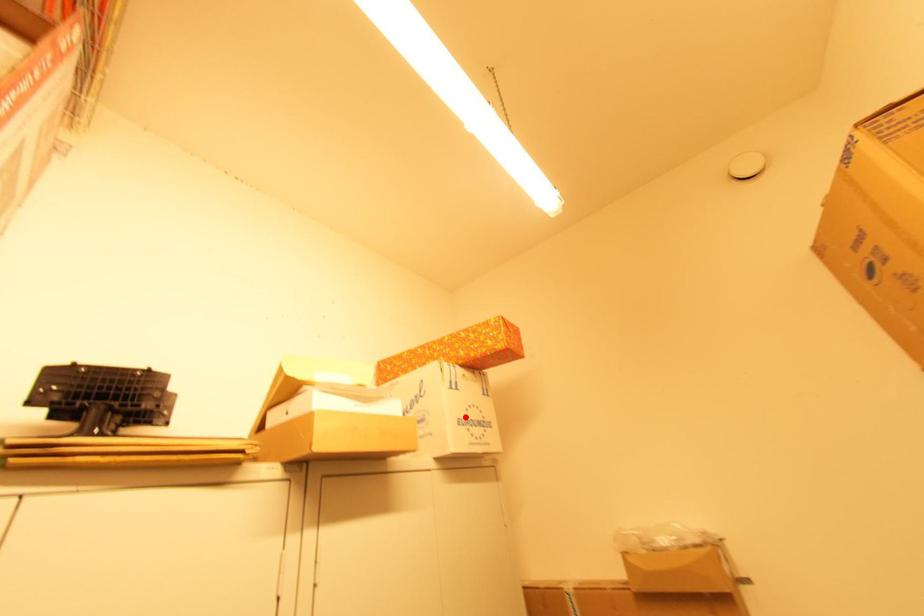
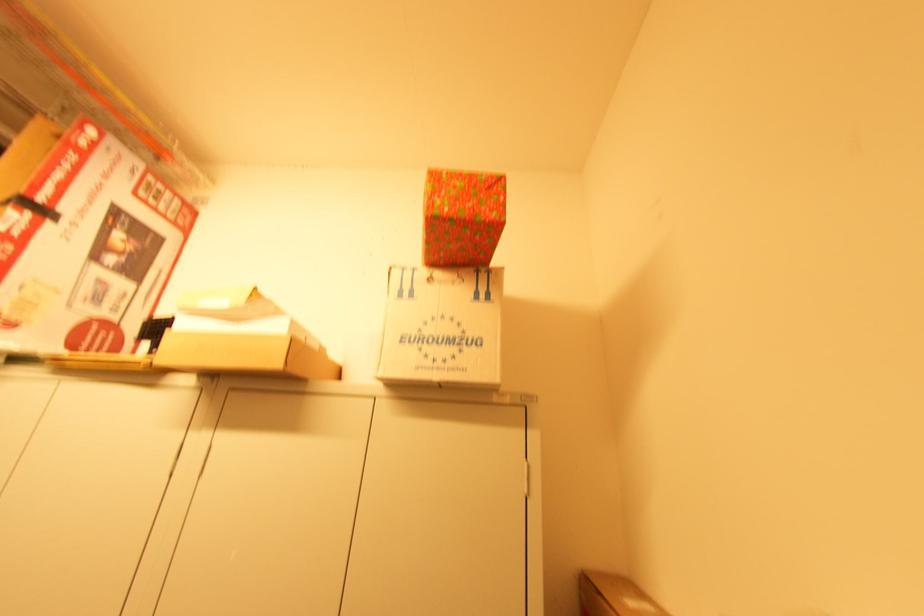
In the second image, find the point that corresponds to the highlighted location in the first image.

(418, 333)